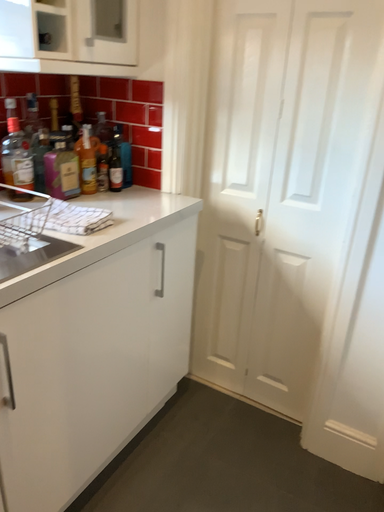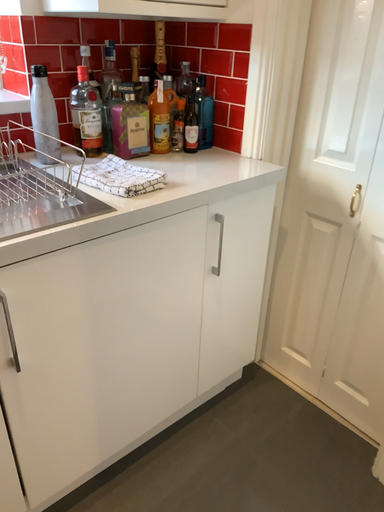
Question: How did the camera likely rotate when shooting the video?

Choices:
 (A) rotated left
 (B) rotated right

Answer: (A)